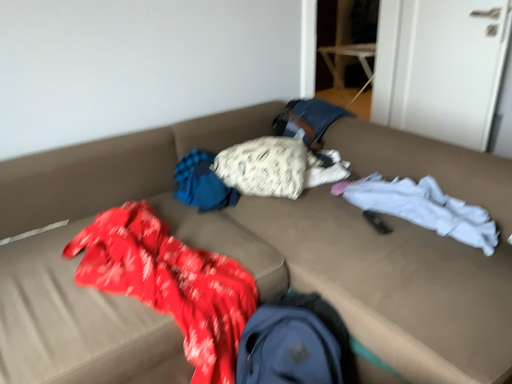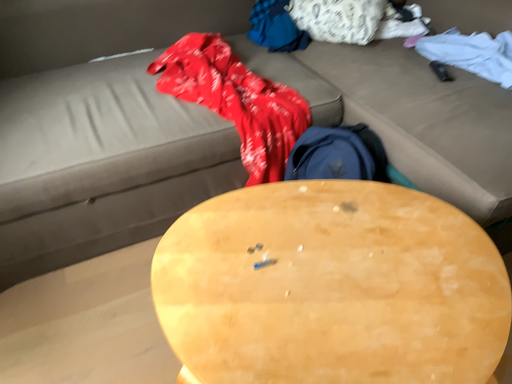
Question: Which way did the camera rotate in the video?

Choices:
 (A) rotated downward
 (B) rotated upward

Answer: (A)